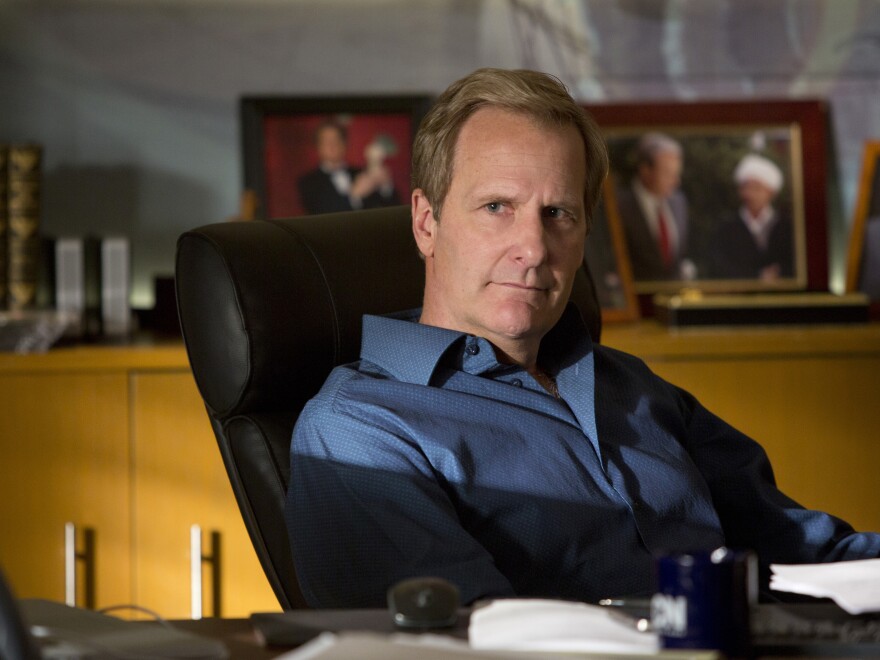
Locate an element on the screen. The width and height of the screenshot is (880, 660). wall is located at coordinates (136, 472).